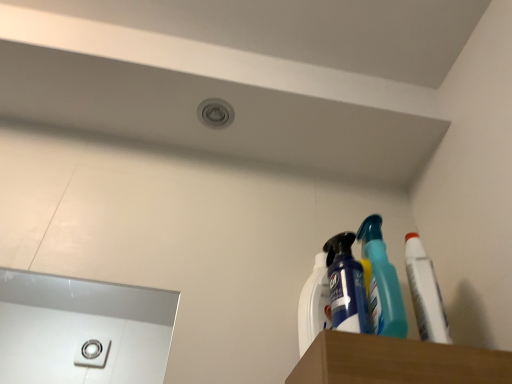
Locate an element on the screen. The height and width of the screenshot is (384, 512). blue glossy spray bottle at upper right, arranged as the first cleaning product when viewed from the right is located at coordinates (346, 286).

Looking at the image, does blue glossy spray bottle at upper right, the 2th cleaning product viewed from the left, seem bigger or smaller compared to white plastic spray bottle at upper right, which appears as the 2th cleaning product when viewed from the right?

Clearly, blue glossy spray bottle at upper right, the 2th cleaning product viewed from the left, is larger in size than white plastic spray bottle at upper right, which appears as the 2th cleaning product when viewed from the right.

Is blue glossy spray bottle at upper right, arranged as the first cleaning product when viewed from the right, far away from white plastic spray bottle at upper right, which is the first cleaning product from left to right?

blue glossy spray bottle at upper right, arranged as the first cleaning product when viewed from the right, is near white plastic spray bottle at upper right, which is the first cleaning product from left to right, not far away.

Is blue glossy spray bottle at upper right, arranged as the first cleaning product when viewed from the right, positioned with its back to white plastic spray bottle at upper right, which appears as the 2th cleaning product when viewed from the right?

Yes, blue glossy spray bottle at upper right, arranged as the first cleaning product when viewed from the right, is positioned with its back facing white plastic spray bottle at upper right, which appears as the 2th cleaning product when viewed from the right.

From a real-world perspective, is blue glossy spray bottle at upper right, the 2th cleaning product viewed from the left, beneath white matte toothpaste at right?

Actually, blue glossy spray bottle at upper right, the 2th cleaning product viewed from the left, is physically above white matte toothpaste at right in the real world.

Measure the distance between blue glossy spray bottle at upper right, the 2th cleaning product viewed from the left, and white matte toothpaste at right.

blue glossy spray bottle at upper right, the 2th cleaning product viewed from the left, is 5.97 inches away from white matte toothpaste at right.

Could white matte toothpaste at right be considered to be inside blue glossy spray bottle at upper right, the 2th cleaning product viewed from the left?

No, blue glossy spray bottle at upper right, the 2th cleaning product viewed from the left, does not contain white matte toothpaste at right.

Considering the relative positions of blue glossy spray bottle at upper right, arranged as the first cleaning product when viewed from the right, and white matte toothpaste at right in the image provided, is blue glossy spray bottle at upper right, arranged as the first cleaning product when viewed from the right, to the left of white matte toothpaste at right from the viewer's perspective?

Yes.

Can you confirm if white matte toothpaste at right is shorter than blue glossy spray bottle at upper right, arranged as the first cleaning product when viewed from the right?

No.

Consider the image. Between white matte toothpaste at right and blue glossy spray bottle at upper right, the 2th cleaning product viewed from the left, which one appears on the left side from the viewer's perspective?

Positioned to the left is blue glossy spray bottle at upper right, the 2th cleaning product viewed from the left.

Where is `toothpaste lying below the blue glossy spray bottle at upper right, arranged as the first cleaning product when viewed from the right (from the image's perspective)`? toothpaste lying below the blue glossy spray bottle at upper right, arranged as the first cleaning product when viewed from the right (from the image's perspective) is located at coordinates (425, 292).

Is white matte toothpaste at right positioned with its back to blue glossy spray bottle at upper right, the 2th cleaning product viewed from the left?

No, blue glossy spray bottle at upper right, the 2th cleaning product viewed from the left, is not at the back of white matte toothpaste at right.

From the image's perspective, between white plastic spray bottle at upper right, which appears as the 2th cleaning product when viewed from the right, and blue glossy spray bottle at upper right, arranged as the first cleaning product when viewed from the right, which one is located above?

blue glossy spray bottle at upper right, arranged as the first cleaning product when viewed from the right.

Which is more to the left, white plastic spray bottle at upper right, which appears as the 2th cleaning product when viewed from the right, or blue glossy spray bottle at upper right, arranged as the first cleaning product when viewed from the right?

white plastic spray bottle at upper right, which appears as the 2th cleaning product when viewed from the right.

Could you measure the distance between white plastic spray bottle at upper right, which appears as the 2th cleaning product when viewed from the right, and blue glossy spray bottle at upper right, arranged as the first cleaning product when viewed from the right?

white plastic spray bottle at upper right, which appears as the 2th cleaning product when viewed from the right, and blue glossy spray bottle at upper right, arranged as the first cleaning product when viewed from the right, are 1.75 inches apart from each other.

Is white plastic spray bottle at upper right, which appears as the 2th cleaning product when viewed from the right, wider or thinner than blue glossy spray bottle at upper right, the 2th cleaning product viewed from the left?

Considering their sizes, white plastic spray bottle at upper right, which appears as the 2th cleaning product when viewed from the right, looks slimmer than blue glossy spray bottle at upper right, the 2th cleaning product viewed from the left.

Considering the relative positions of white plastic spray bottle at upper right, which is the first cleaning product from left to right, and white matte toothpaste at right in the image provided, is white plastic spray bottle at upper right, which is the first cleaning product from left to right, behind white matte toothpaste at right?

Yes.

Can you confirm if white plastic spray bottle at upper right, which appears as the 2th cleaning product when viewed from the right, is positioned to the right of white matte toothpaste at right?

In fact, white plastic spray bottle at upper right, which appears as the 2th cleaning product when viewed from the right, is to the left of white matte toothpaste at right.

Does point (321, 294) appear closer or farther from the camera than point (434, 288)?

Clearly, point (321, 294) is more distant from the camera than point (434, 288).

From the image's perspective, relative to white matte toothpaste at right, is white plastic spray bottle at upper right, which is the first cleaning product from left to right, above or below?

white plastic spray bottle at upper right, which is the first cleaning product from left to right, is situated lower than white matte toothpaste at right in the image.

Is white matte toothpaste at right bigger or smaller than white plastic spray bottle at upper right, which appears as the 2th cleaning product when viewed from the right?

Considering their sizes, white matte toothpaste at right takes up more space than white plastic spray bottle at upper right, which appears as the 2th cleaning product when viewed from the right.

How different are the orientations of white matte toothpaste at right and white plastic spray bottle at upper right, which is the first cleaning product from left to right, in degrees?

There is a 0.00331-degree angle between the facing directions of white matte toothpaste at right and white plastic spray bottle at upper right, which is the first cleaning product from left to right.

Is point (426, 333) less distant than point (324, 293)?

No, it is behind (324, 293).

Could you tell me if white matte toothpaste at right is facing white plastic spray bottle at upper right, which appears as the 2th cleaning product when viewed from the right?

No, white matte toothpaste at right does not turn towards white plastic spray bottle at upper right, which appears as the 2th cleaning product when viewed from the right.

This screenshot has width=512, height=384. Identify the location of cleaning product below the blue glossy spray bottle at upper right, the 2th cleaning product viewed from the left (from the image's perspective). coord(314,304).

Find the location of a particular element. The width and height of the screenshot is (512, 384). cleaning product that is the 1st one when counting leftward from the white matte toothpaste at right is located at coordinates (346, 286).

Which object lies further to the anchor point blue glossy spray bottle at upper right, arranged as the first cleaning product when viewed from the right, white matte toothpaste at right or white plastic spray bottle at upper right, which is the first cleaning product from left to right?

white matte toothpaste at right.

When comparing their distances from white matte toothpaste at right, does blue glossy spray bottle at upper right, the 2th cleaning product viewed from the left, or white plastic spray bottle at upper right, which is the first cleaning product from left to right, seem closer?

blue glossy spray bottle at upper right, the 2th cleaning product viewed from the left, lies closer to white matte toothpaste at right than the other object.

Based on their spatial positions, is white plastic spray bottle at upper right, which appears as the 2th cleaning product when viewed from the right, or blue glossy spray bottle at upper right, the 2th cleaning product viewed from the left, further from white matte toothpaste at right?

Based on the image, white plastic spray bottle at upper right, which appears as the 2th cleaning product when viewed from the right, appears to be further to white matte toothpaste at right.

Estimate the real-world distances between objects in this image. Which object is further from white plastic spray bottle at upper right, which appears as the 2th cleaning product when viewed from the right, white matte toothpaste at right or blue glossy spray bottle at upper right, the 2th cleaning product viewed from the left?

Among the two, white matte toothpaste at right is located further to white plastic spray bottle at upper right, which appears as the 2th cleaning product when viewed from the right.

Looking at the image, which one is located further to blue glossy spray bottle at upper right, arranged as the first cleaning product when viewed from the right, white plastic spray bottle at upper right, which appears as the 2th cleaning product when viewed from the right, or white matte toothpaste at right?

The object further to blue glossy spray bottle at upper right, arranged as the first cleaning product when viewed from the right, is white matte toothpaste at right.

Estimate the real-world distances between objects in this image. Which object is further from white plastic spray bottle at upper right, which appears as the 2th cleaning product when viewed from the right, blue glossy spray bottle at upper right, arranged as the first cleaning product when viewed from the right, or white matte toothpaste at right?

The object further to white plastic spray bottle at upper right, which appears as the 2th cleaning product when viewed from the right, is white matte toothpaste at right.

I want to click on cleaning product situated between white plastic spray bottle at upper right, which is the first cleaning product from left to right, and white matte toothpaste at right from left to right, so click(x=346, y=286).